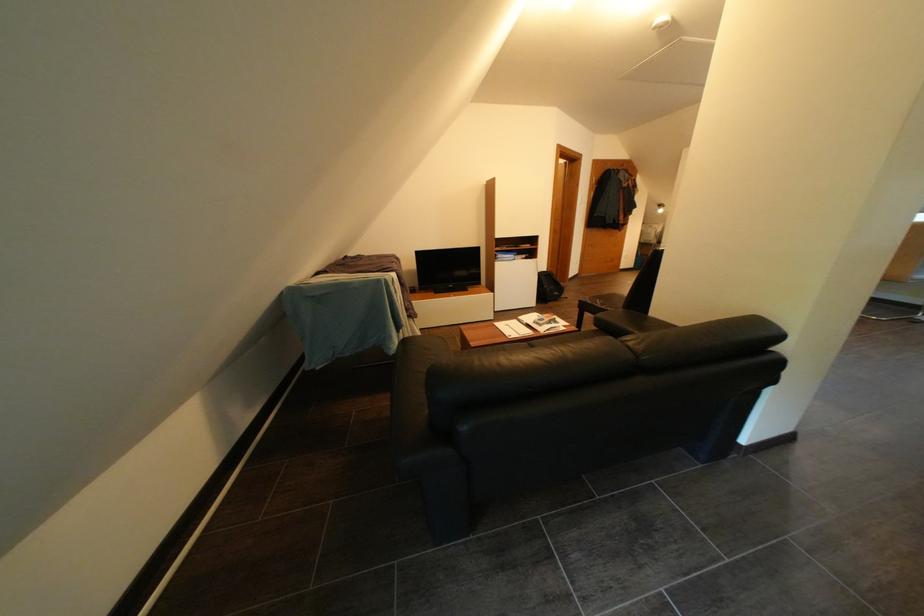
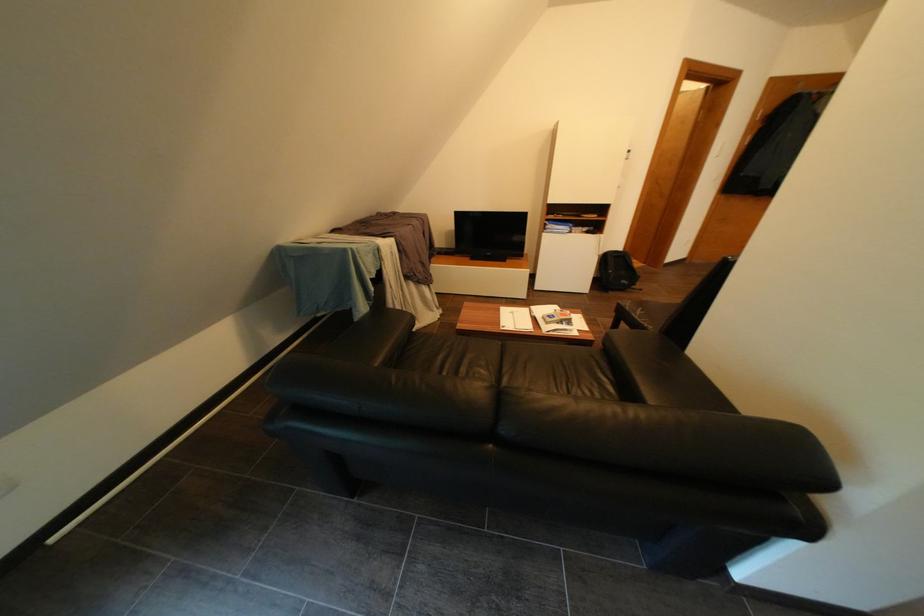
Question: The camera is either moving clockwise (left) or counter-clockwise (right) around the object. The first image is from the beginning of the video and the second image is from the end. Is the camera moving left or right when shooting the video?

Choices:
 (A) Left
 (B) Right

Answer: (B)